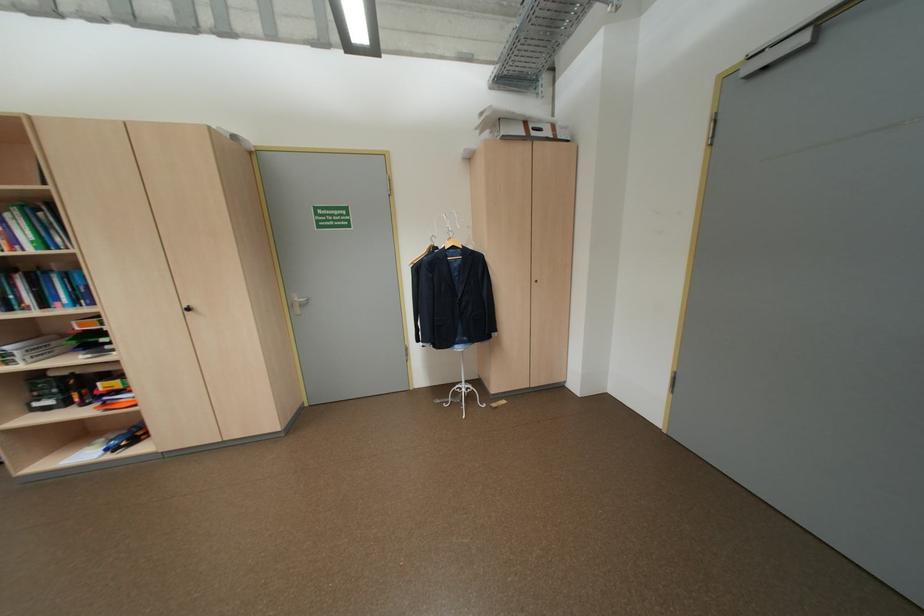
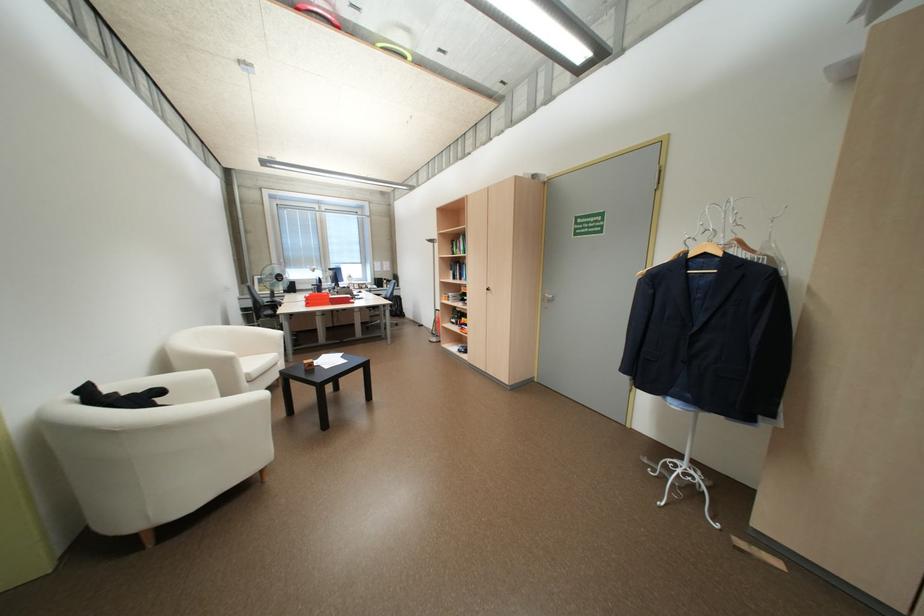
Where in the second image is the point corresponding to [464,246] from the first image?

(714, 254)